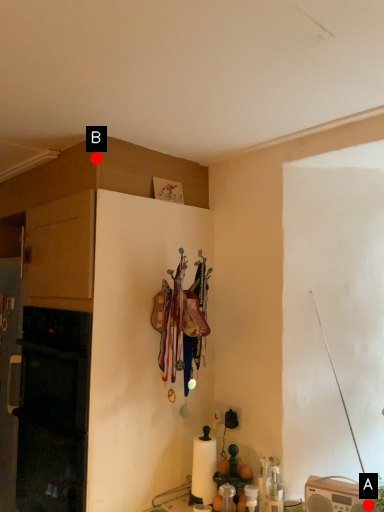
Question: Two points are circled on the image, labeled by A and B beside each circle. Which point is closer to the camera?

Choices:
 (A) A is closer
 (B) B is closer

Answer: (A)